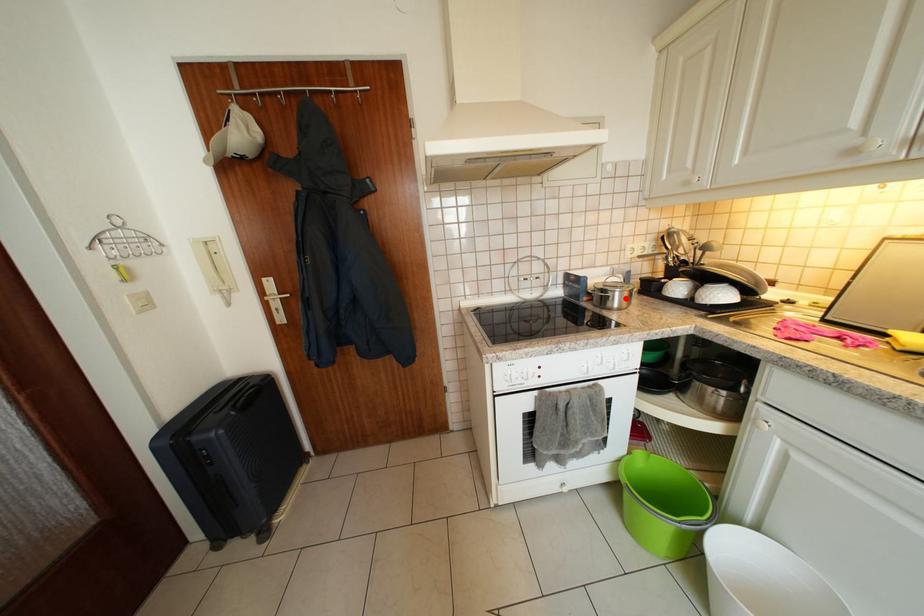
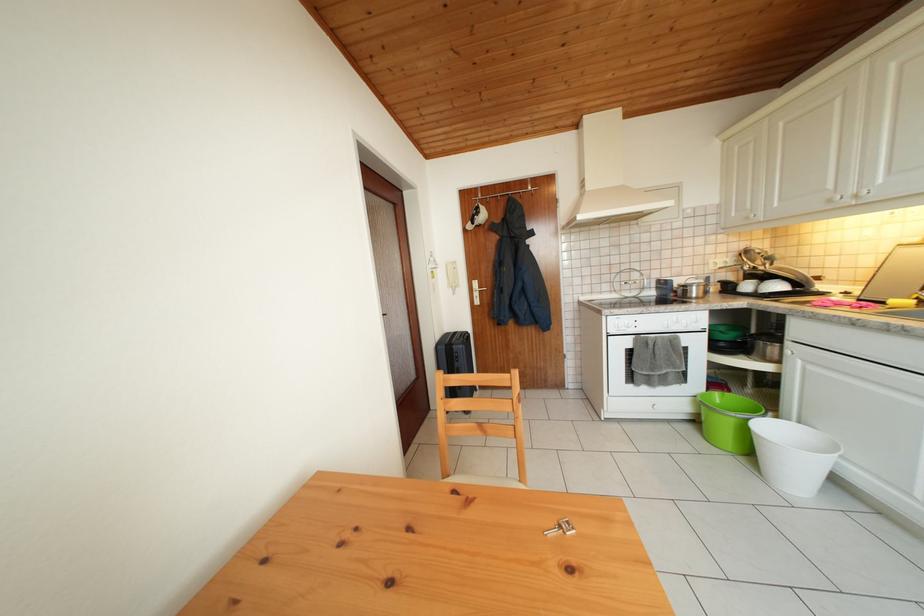
Locate, in the second image, the point that corresponds to the highlighted location in the first image.

(702, 294)